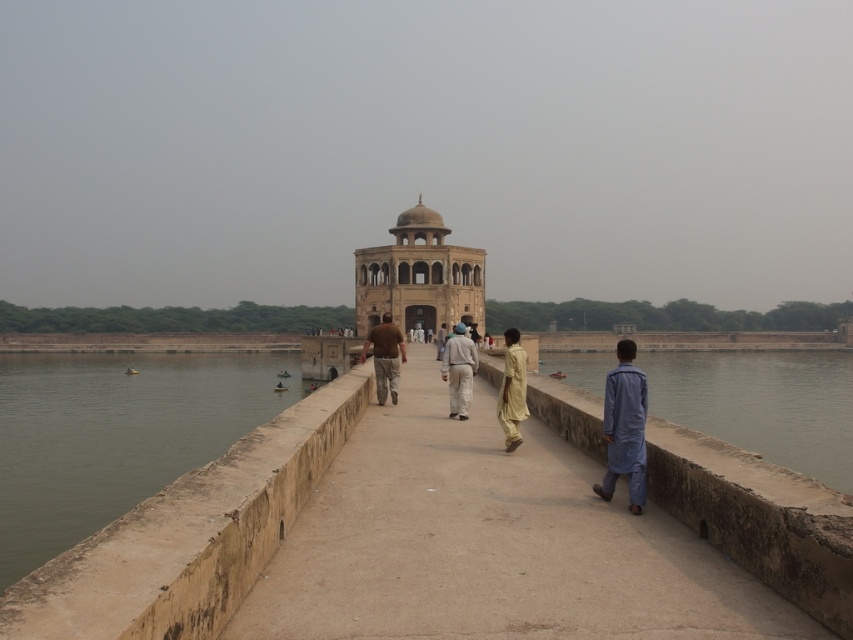
Question: Is light yellow fabric at center above light beige cotton pants at center?

Choices:
 (A) no
 (B) yes

Answer: (A)

Question: Does brown stone wall at lower left appear on the left side of green concrete river at lower right?

Choices:
 (A) no
 (B) yes

Answer: (B)

Question: Among these objects, which one is nearest to the camera?

Choices:
 (A) light yellow fabric at center
 (B) light brown fabric shirt at center
 (C) green concrete river at lower right
 (D) brown stone wall at lower left

Answer: (C)

Question: Which point is closer to the camera?

Choices:
 (A) (451, 358)
 (B) (109, 499)
 (C) (631, 392)

Answer: (C)

Question: Can you confirm if brown stone wall at lower left is positioned to the right of brown cotton shirt at center?

Choices:
 (A) yes
 (B) no

Answer: (B)

Question: Which point is closer to the camera taking this photo?

Choices:
 (A) click(x=444, y=323)
 (B) click(x=630, y=346)
 (C) click(x=720, y=438)
 (D) click(x=521, y=401)

Answer: (B)